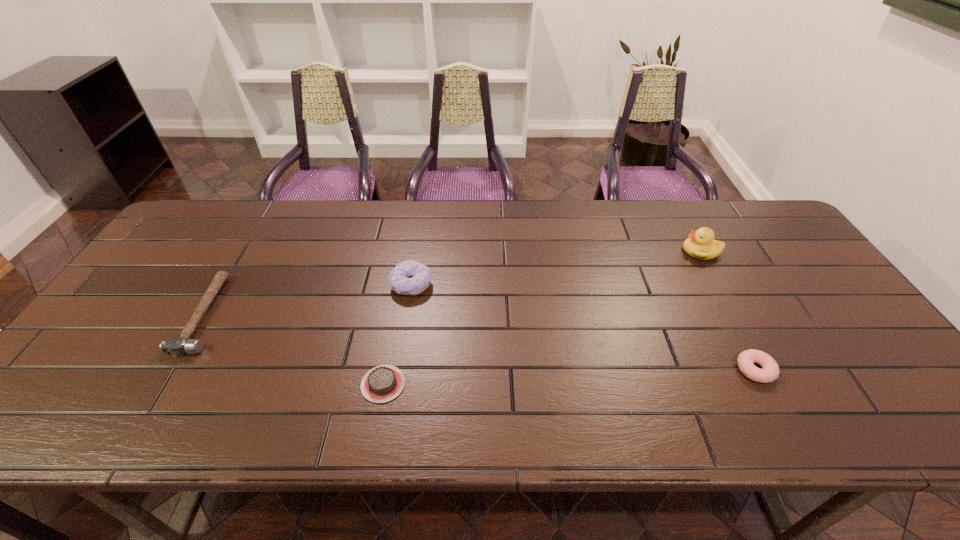
Locate an element on the screen. free space located 0.380m at the face of the farthest object is located at coordinates click(557, 251).

Where is `vacant space located on the front of the farther doughnut`? This screenshot has width=960, height=540. vacant space located on the front of the farther doughnut is located at coordinates (396, 380).

Where is `vacant space located on the striking face of the leftmost object`? The height and width of the screenshot is (540, 960). vacant space located on the striking face of the leftmost object is located at coordinates (257, 314).

Locate an element on the screen. The image size is (960, 540). vacant area located on the back of the nearer doughnut is located at coordinates (697, 260).

You are a GUI agent. You are given a task and a screenshot of the screen. Output one action in this format:
    pyautogui.click(x=<x>, y=<y>)
    Task: Click on the vacant space located 0.160m on the right of the chocolate cake
    The image size is (960, 540).
    Given the screenshot: What is the action you would take?
    pyautogui.click(x=475, y=384)

The height and width of the screenshot is (540, 960). Identify the location of object that is positioned at the far edge. (701, 245).

Identify the location of object present at the near edge. (383, 383).

The height and width of the screenshot is (540, 960). In the image, there is a desktop. In order to click on vacant space at the far edge in this screenshot , I will do `click(278, 233)`.

The height and width of the screenshot is (540, 960). I want to click on vacant space at the near edge of the desktop, so click(x=224, y=415).

Identify the location of free region at the left edge of the desktop. The width and height of the screenshot is (960, 540). coord(108,324).